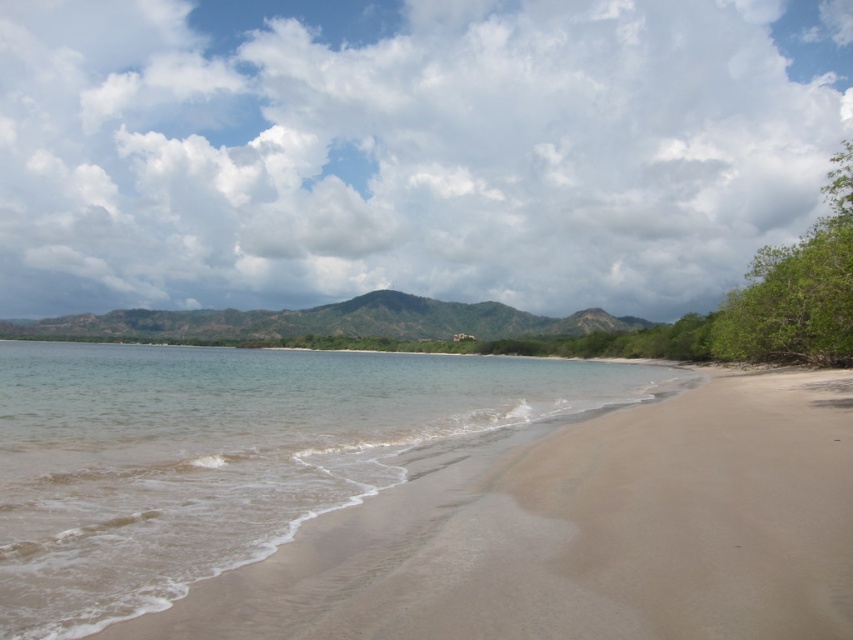
Who is more forward, [206,536] or [456,320]?

Point [206,536] is more forward.

Which of these two, clear water at beach center or green textured mountain at center, stands shorter?

clear water at beach center

Between point (218, 520) and point (518, 314), which one is positioned in front?

Point (218, 520)

You are a GUI agent. You are given a task and a screenshot of the screen. Output one action in this format:
    pyautogui.click(x=<x>, y=<y>)
    Task: Click on the clear water at beach center
    
    Given the screenshot: What is the action you would take?
    pyautogui.click(x=231, y=456)